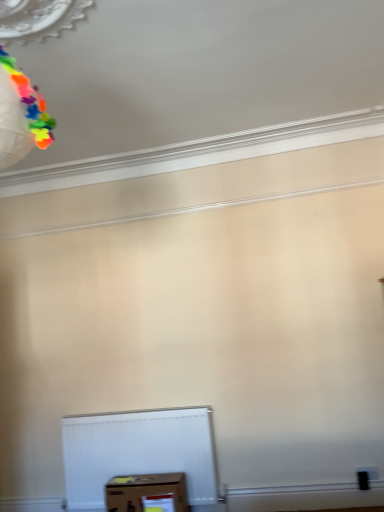
Question: Looking at their shapes, would you say multicolored paper at upper left is wider or thinner than brown cardboard box at lower center?

Choices:
 (A) thin
 (B) wide

Answer: (A)

Question: Considering the positions of multicolored paper at upper left and brown cardboard box at lower center in the image, is multicolored paper at upper left taller or shorter than brown cardboard box at lower center?

Choices:
 (A) tall
 (B) short

Answer: (A)

Question: From a real-world perspective, is multicolored paper at upper left physically located above or below brown cardboard box at lower center?

Choices:
 (A) above
 (B) below

Answer: (A)

Question: From their relative heights in the image, would you say brown cardboard box at lower center is taller or shorter than multicolored paper at upper left?

Choices:
 (A) short
 (B) tall

Answer: (A)

Question: Considering the positions of brown cardboard box at lower center and multicolored paper at upper left in the image, is brown cardboard box at lower center wider or thinner than multicolored paper at upper left?

Choices:
 (A) wide
 (B) thin

Answer: (A)

Question: Would you say brown cardboard box at lower center is inside or outside multicolored paper at upper left?

Choices:
 (A) outside
 (B) inside

Answer: (A)

Question: Considering the relative positions of brown cardboard box at lower center and multicolored paper at upper left in the image provided, is brown cardboard box at lower center to the left or to the right of multicolored paper at upper left?

Choices:
 (A) right
 (B) left

Answer: (A)